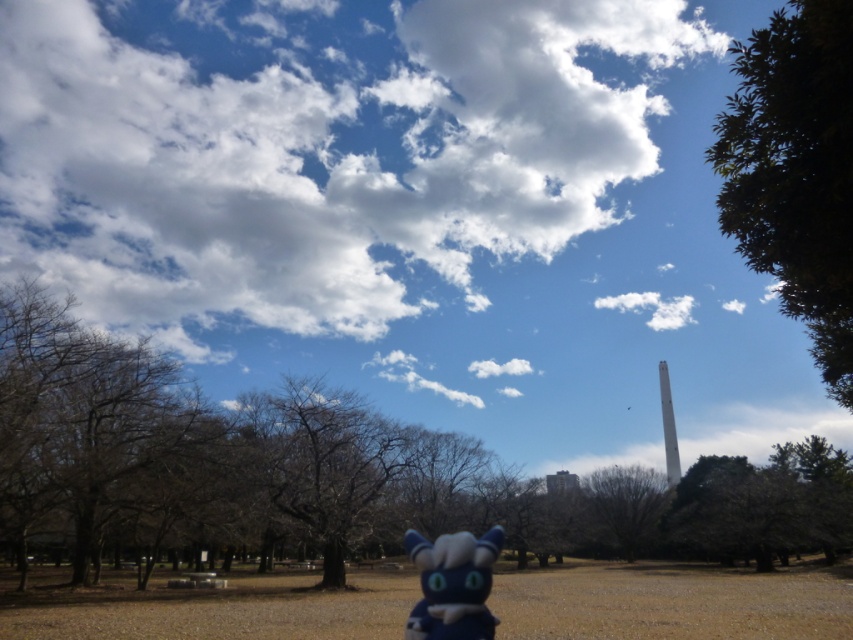
You are planning to take a photo of the green leafy tree at upper right and the brown leafless tree at center. Which tree should you focus on if you want to capture the larger one in your shot?

The green leafy tree at upper right is bigger than the brown leafless tree at center, so you should focus on the green leafy tree at upper right to capture the larger one in your shot.

In the scene shown: You are a bird looking for a place to perch. You see the green leafy tree at upper right and the brown leafless tree at center. Which tree is closer to you?

The green leafy tree at upper right is closer to you because it is in front of the brown leafless tree at center.